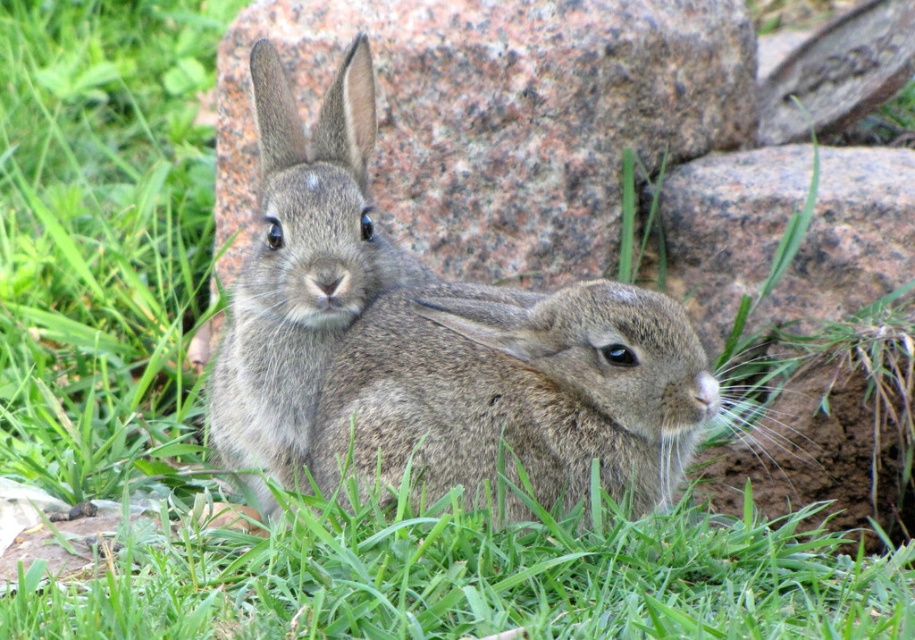
Question: Is fuzzy brown rabbit at center smaller than fuzzy gray rabbit at center?

Choices:
 (A) no
 (B) yes

Answer: (B)

Question: Which point is farther to the camera?

Choices:
 (A) (657, 484)
 (B) (278, 204)

Answer: (B)

Question: Is fuzzy brown rabbit at center smaller than fuzzy gray rabbit at center?

Choices:
 (A) yes
 (B) no

Answer: (A)

Question: Can you confirm if fuzzy brown rabbit at center is positioned to the left of fuzzy gray rabbit at center?

Choices:
 (A) no
 (B) yes

Answer: (A)

Question: Which point is farther to the camera?

Choices:
 (A) fuzzy gray rabbit at center
 (B) fuzzy brown rabbit at center

Answer: (A)